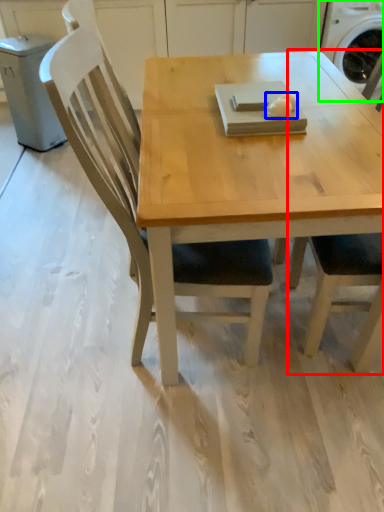
Question: Which is nearer to the chair (highlighted by a red box)? food (highlighted by a blue box) or washing machine (highlighted by a green box).

Choices:
 (A) food
 (B) washing machine

Answer: (A)